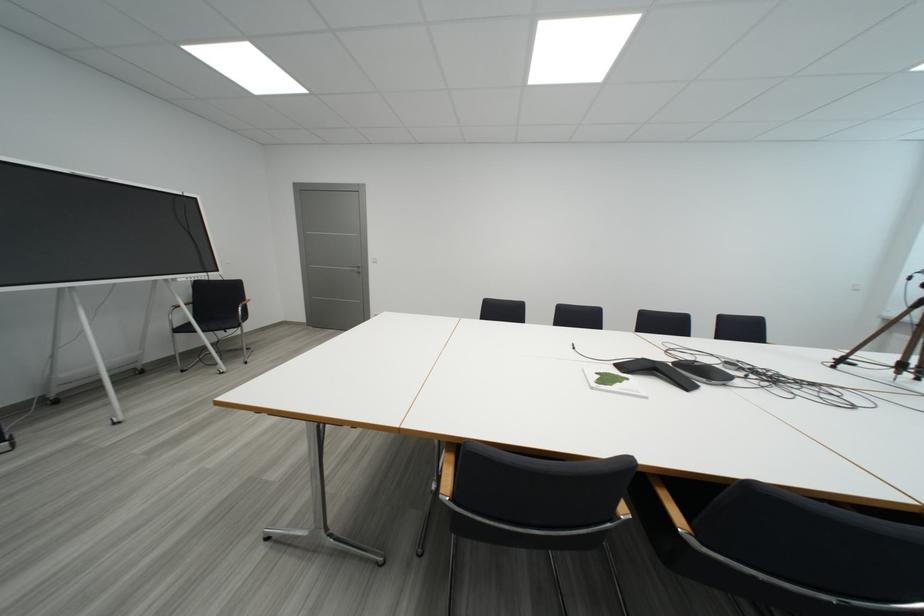
The width and height of the screenshot is (924, 616). What do you see at coordinates (702, 371) in the screenshot?
I see `the conference microphone` at bounding box center [702, 371].